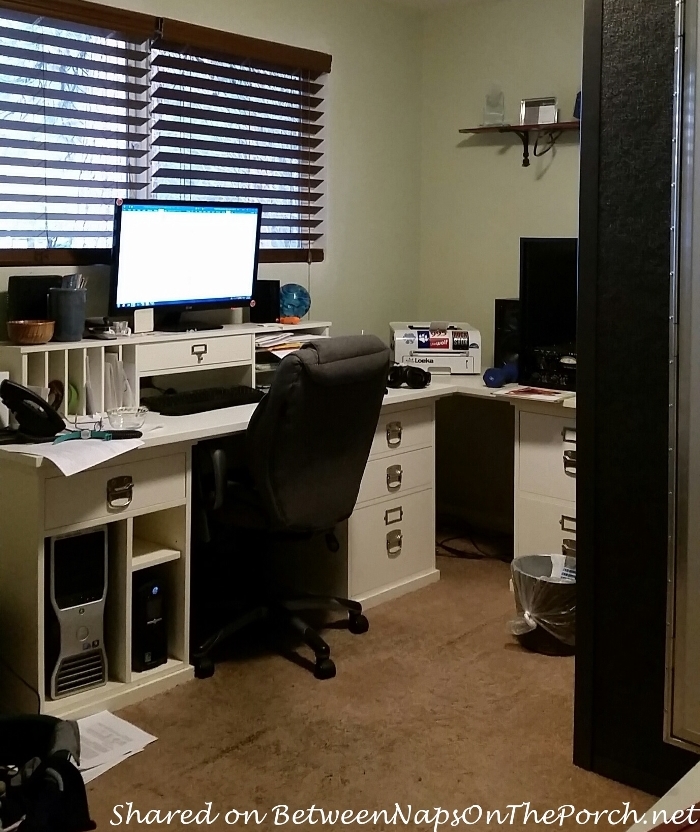
The image size is (700, 832). I want to click on windows, so click(x=52, y=136), click(x=213, y=151).